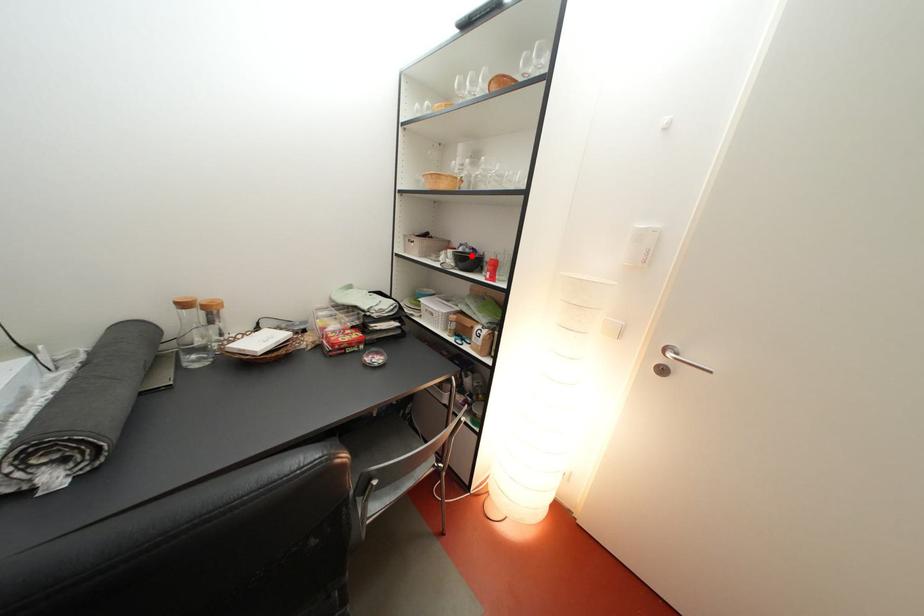
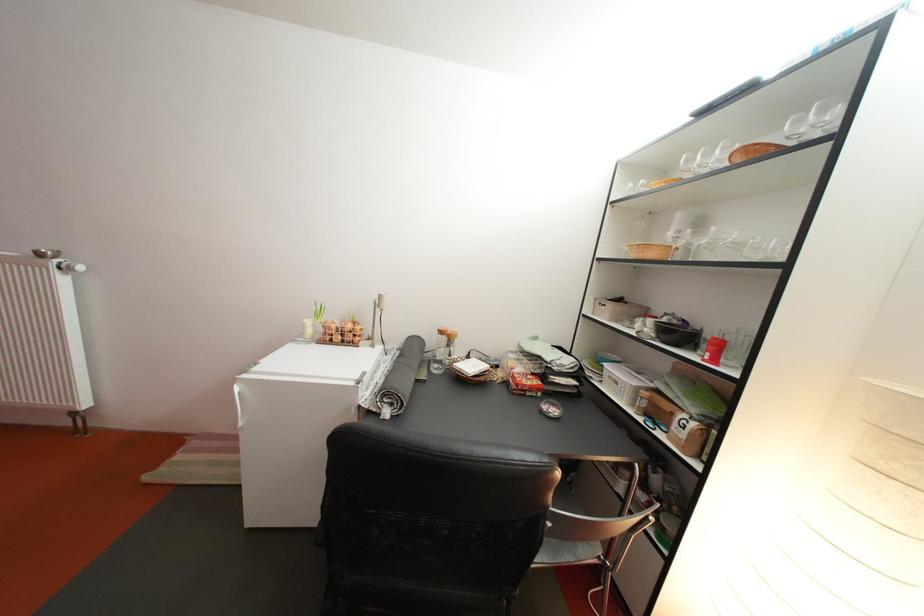
Where in the second image is the point corresponding to the highlighted location from the first image?

(675, 326)